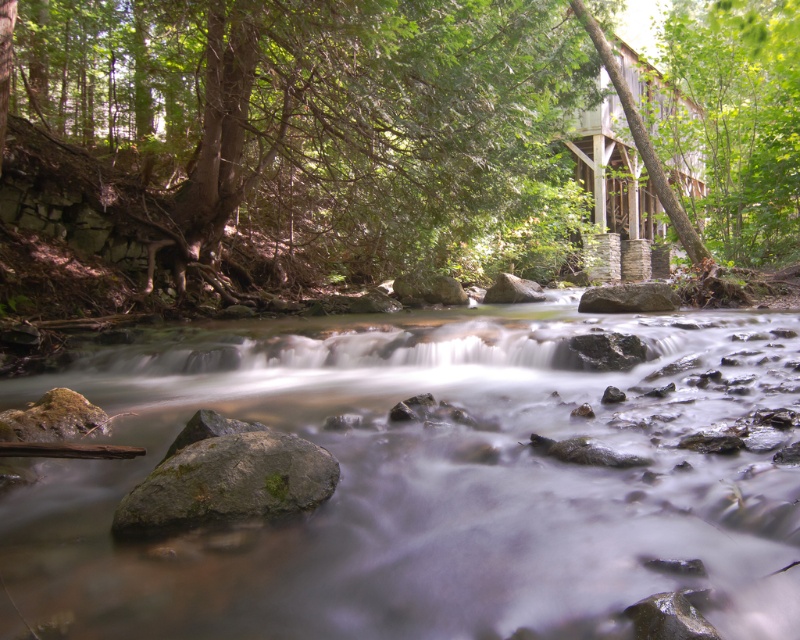
You are standing at the edge of the stream and see two points marked in the image. The first point is at coordinates point (641, 524) and the second is at point (254, 451). Which point is closer to your current position?

Point (641, 524) is closer to the camera than point (254, 451), so the first point is closer to your current position.

You are a hiker who wants to cross the stream. You see the clear water at center and the green leafy tree at upper center. Which direction should you head to reach the tree from the water?

To reach the green leafy tree at upper center from the clear water at center, you should head to the right since the clear water at center is to the left of the green leafy tree at upper center.

In the scene shown: You are standing in the middle of the stream and notice the clear water at center and the green leafy tree at upper center. Which object is nearer to you?

The clear water at center is closer to the viewer than the green leafy tree at upper center.